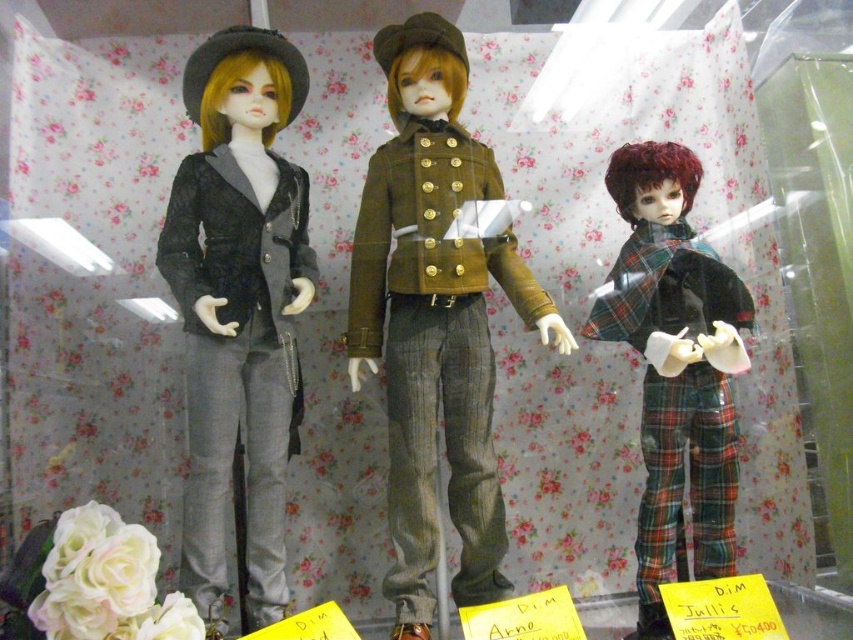
What does the point at coordinates (434, 349) correspond to in the image?

The point at coordinates (434, 349) corresponds to the matte brown jacket at center.

You are a customer standing in front of the display case. You want to reach the matte black jacket at left to touch it. Can you do so if your arm can extend 1.05 meters?

The matte black jacket at left is 1.10 meters away from the viewer, so your arm can only reach 1.05 meters. Therefore, you cannot touch the matte black jacket at left.

You are a customer in a doll store and want to find the matte brown jacket at center. According to the coordinates given, where should you look relative to the other dolls?

The matte brown jacket at center is located at coordinates point (434,349), which is in the center position among the three dolls displayed.